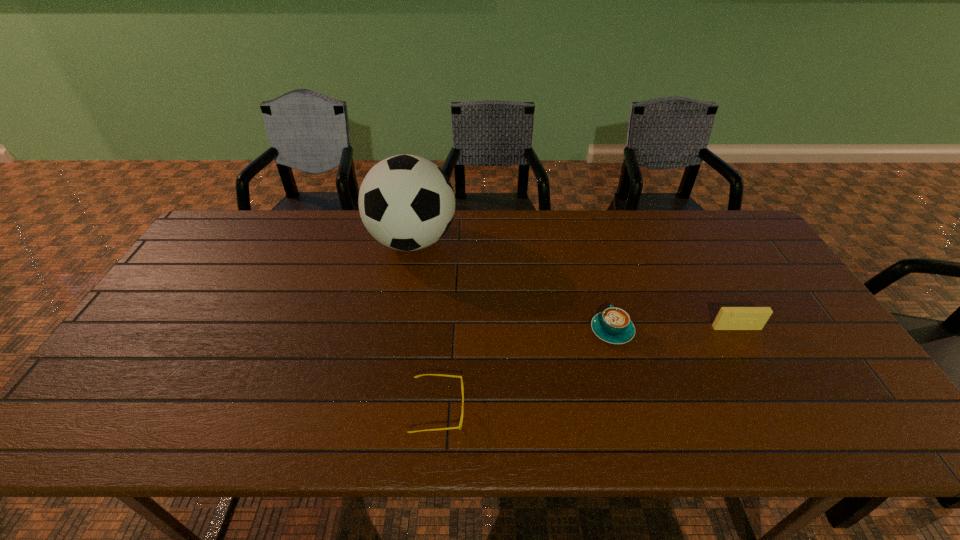
Locate an element on the screen. vacant space at the right edge is located at coordinates (777, 287).

Find the location of a particular element. free space between the cappuccino and the soccer ball is located at coordinates (512, 286).

Identify the location of empty space between the farthest object and the nearest object. The height and width of the screenshot is (540, 960). (425, 325).

Locate an element on the screen. free spot between the farthest object and the cappuccino is located at coordinates (512, 286).

This screenshot has width=960, height=540. I want to click on empty space between the second shortest object and the nearest object, so click(525, 370).

The width and height of the screenshot is (960, 540). I want to click on unoccupied position between the farthest object and the spectacles, so click(x=425, y=325).

This screenshot has width=960, height=540. I want to click on free point between the nearest object and the second shortest object, so click(x=525, y=370).

Find the location of `vacant area that lies between the videotape and the cappuccino`. vacant area that lies between the videotape and the cappuccino is located at coordinates (674, 329).

Locate an element on the screen. Image resolution: width=960 pixels, height=540 pixels. vacant region between the farthest object and the second object from right to left is located at coordinates (512, 286).

I want to click on empty space that is in between the third shortest object and the second shortest object, so click(x=674, y=329).